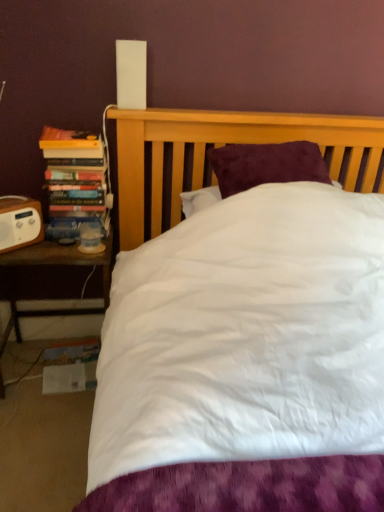
The width and height of the screenshot is (384, 512). Find the location of `brown wooden nightstand at left`. brown wooden nightstand at left is located at coordinates (53, 279).

Find the location of a particular element. This screenshot has width=384, height=512. hardcover books at left is located at coordinates (76, 175).

Find the location of a particular element. The width and height of the screenshot is (384, 512). white plastic speaker at left is located at coordinates (19, 222).

What is the approximate width of white plastic speaker at left?

white plastic speaker at left is 4.23 inches in width.

Where is `brown wooden nightstand at left`? The height and width of the screenshot is (512, 384). brown wooden nightstand at left is located at coordinates (53, 279).

What's the angular difference between brown wooden nightstand at left and hardcover books at left's facing directions?

The angle between the facing direction of brown wooden nightstand at left and the facing direction of hardcover books at left is 0.000541 degrees.

Is point (99, 291) closer or farther from the camera than point (44, 156)?

Point (99, 291) appears to be farther away from the viewer than point (44, 156).

Is brown wooden nightstand at left located outside hardcover books at left?

Yes.

Based on the photo, from a real-world perspective, is brown wooden nightstand at left above or below hardcover books at left?

brown wooden nightstand at left is situated lower than hardcover books at left in the real world.

Is hardcover books at left wider than white plastic speaker at left?

Yes.

Is hardcover books at left not near white plastic speaker at left?

That's not correct — hardcover books at left is a little close to white plastic speaker at left.

Is hardcover books at left facing away from white plastic speaker at left?

No, hardcover books at left is not facing away from white plastic speaker at left.

Looking at this image, which is less distant, (107, 207) or (24, 223)?

The point (24, 223) is more forward.

Consider the image. Is hardcover books at left oriented away from brown wooden nightstand at left?

That's not correct — hardcover books at left is not looking away from brown wooden nightstand at left.

How different are the orientations of hardcover books at left and brown wooden nightstand at left in degrees?

There is a 0.000541-degree angle between the facing directions of hardcover books at left and brown wooden nightstand at left.

Does hardcover books at left lie in front of brown wooden nightstand at left?

No, the depth of hardcover books at left is greater than that of brown wooden nightstand at left.

In terms of width, does hardcover books at left look wider or thinner when compared to brown wooden nightstand at left?

hardcover books at left is thinner than brown wooden nightstand at left.

From a real-world perspective, is brown wooden nightstand at left on top of white plastic speaker at left?

Incorrect, from a real-world perspective, brown wooden nightstand at left is lower than white plastic speaker at left.

Is brown wooden nightstand at left not near white plastic speaker at left?

No, brown wooden nightstand at left is not far from white plastic speaker at left.

From the image's perspective, which one is positioned higher, brown wooden nightstand at left or white plastic speaker at left?

white plastic speaker at left, from the image's perspective.

Which object is closer to the camera, brown wooden nightstand at left or white plastic speaker at left?

Answer: white plastic speaker at left.

Considering the relative sizes of white plastic speaker at left and brown wooden nightstand at left in the image provided, is white plastic speaker at left shorter than brown wooden nightstand at left?

Correct, white plastic speaker at left is not as tall as brown wooden nightstand at left.

Identify the location of speaker located in front of the brown wooden nightstand at left. This screenshot has height=512, width=384. (19, 222).

Does white plastic speaker at left have a greater width compared to brown wooden nightstand at left?

No, white plastic speaker at left is not wider than brown wooden nightstand at left.

Is white plastic speaker at left located outside brown wooden nightstand at left?

Indeed, white plastic speaker at left is completely outside brown wooden nightstand at left.

Would you say white plastic speaker at left is outside hardcover books at left?

white plastic speaker at left is positioned outside hardcover books at left.

Which point is more forward, (1, 221) or (64, 214)?

Point (1, 221)

Could you tell me if white plastic speaker at left is facing hardcover books at left?

No, white plastic speaker at left is not aimed at hardcover books at left.

The image size is (384, 512). I want to click on book above the brown wooden nightstand at left (from the image's perspective), so click(76, 175).

Locate an element on the screen. Image resolution: width=384 pixels, height=512 pixels. speaker in front of the hardcover books at left is located at coordinates (19, 222).

From the image, which object appears to be nearer to brown wooden nightstand at left, white plastic speaker at left or hardcover books at left?

white plastic speaker at left lies closer to brown wooden nightstand at left than the other object.

From the image, which object appears to be nearer to white plastic speaker at left, hardcover books at left or brown wooden nightstand at left?

hardcover books at left lies closer to white plastic speaker at left than the other object.

When comparing their distances from white plastic speaker at left, does brown wooden nightstand at left or hardcover books at left seem further?

The object further to white plastic speaker at left is brown wooden nightstand at left.

Estimate the real-world distances between objects in this image. Which object is further from hardcover books at left, white plastic speaker at left or brown wooden nightstand at left?

The object further to hardcover books at left is brown wooden nightstand at left.

When comparing their distances from hardcover books at left, does brown wooden nightstand at left or white plastic speaker at left seem further?

brown wooden nightstand at left lies further to hardcover books at left than the other object.

Considering their positions, is hardcover books at left positioned further to brown wooden nightstand at left than white plastic speaker at left?

Based on the image, hardcover books at left appears to be further to brown wooden nightstand at left.

The image size is (384, 512). Find the location of `speaker between hardcover books at left and brown wooden nightstand at left in the vertical direction`. speaker between hardcover books at left and brown wooden nightstand at left in the vertical direction is located at coordinates (19, 222).